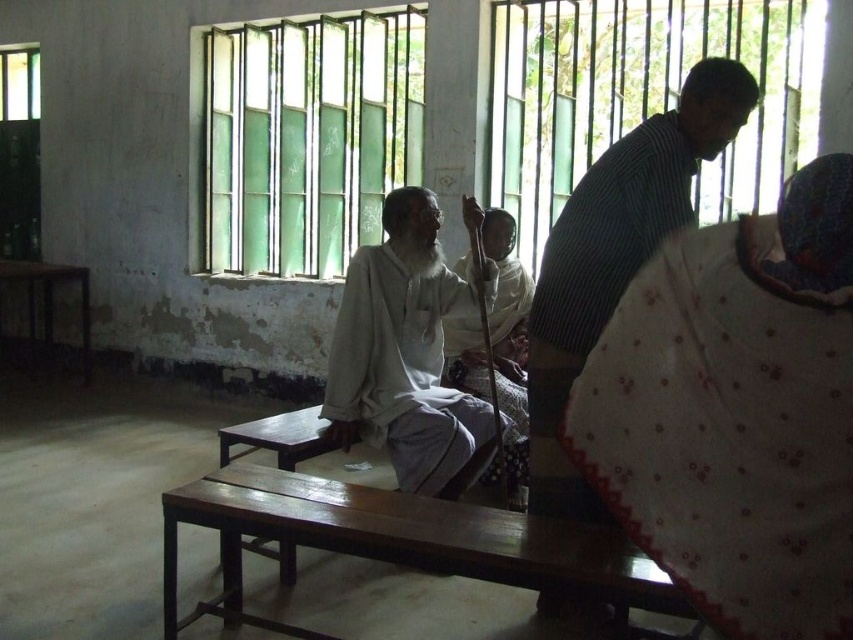
You are standing in the room and see the point at coordinates (408, 355). What is the color of the fabric at that location?

The point at coordinates (408, 355) is on light gray fabric at center.

You are standing in the room and need to place a small plant between the white dotted fabric at lower right and the wooden table at left. Where should you position it?

The white dotted fabric at lower right is to the right of the wooden table at left, so you should place the small plant between them in the middle area between the two objects.